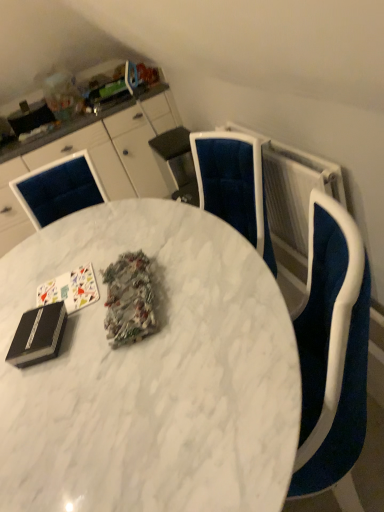
Where is `free spot in front of black matte binder at lower left`? The width and height of the screenshot is (384, 512). free spot in front of black matte binder at lower left is located at coordinates (57, 375).